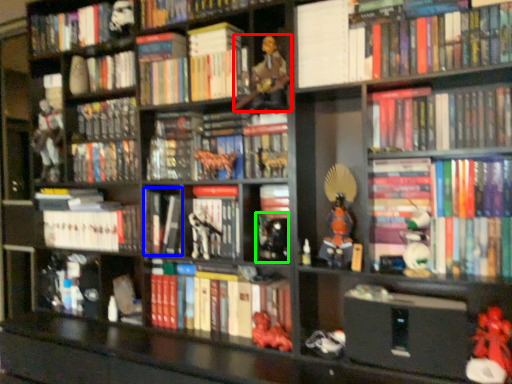
Question: Which object is the closest to the person (highlighted by a red box)? Choose among these: book (highlighted by a blue box) or toy (highlighted by a green box).

Choices:
 (A) book
 (B) toy

Answer: (B)